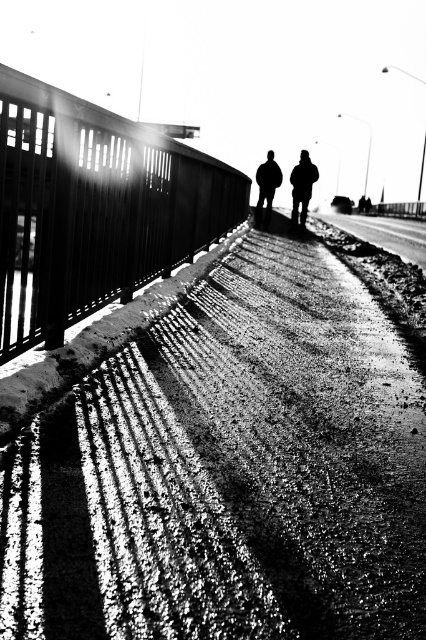
You are standing on the walkway and want to move towards the smooth metal rail at left. Which direction should you walk to reach it from the dark textured jacket at center?

The smooth metal rail at left is positioned on the left side of the dark textured jacket at center, so you should walk to your left to reach it.

You are a delivery person carrying a heavy package and need to walk from the smooth metal rail at left to the dark textured jacket at center. Given that your delivery robot has a maximum operating distance of 20 feet, will it be able to reach the jacket from the rail?

The distance between the smooth metal rail at left and the dark textured jacket at center is 22.76 feet, which exceeds the robot s 20 feet maximum operating distance. Therefore, the robot cannot reach the jacket from the rail.

You are standing on the walkway and want to grab the smooth metal rail at left. Based on the scene description, where would you look to find the rail?

The smooth metal rail at left is located at the point with coordinates 0.327 on the x axis and 0.221 on the y axis.